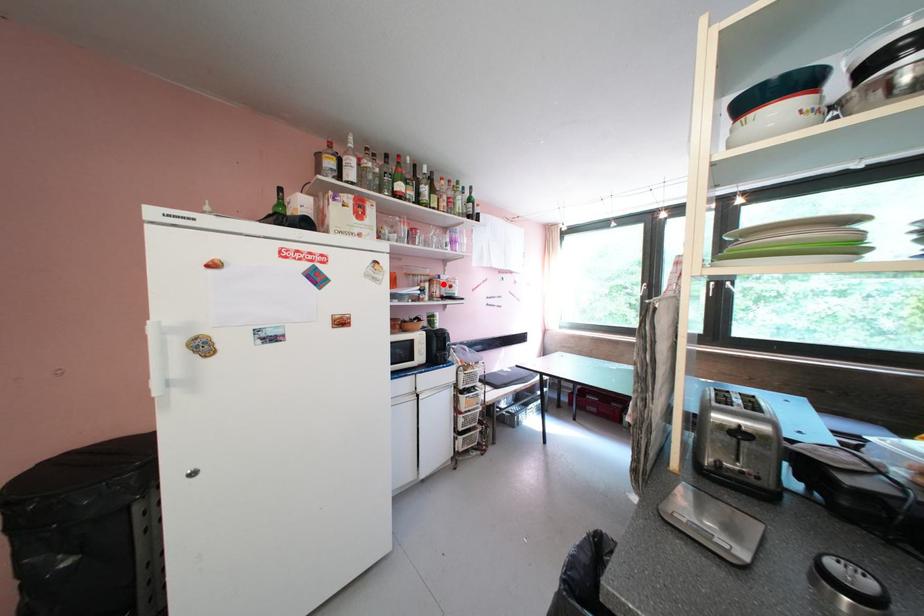
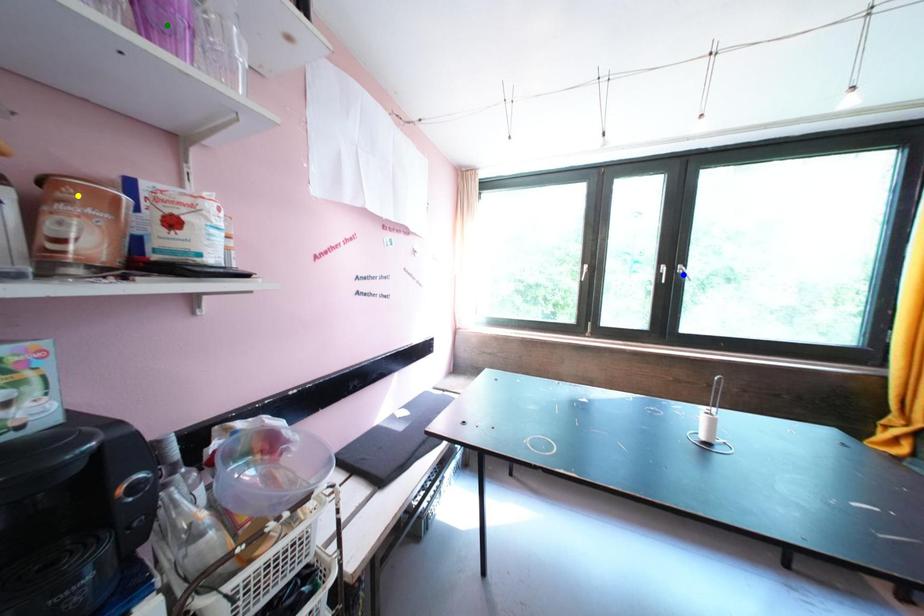
Question: I am providing you with two images of the same scene from different viewpoints. A red point is marked on the first image. You are given multiple points on the second image. Which point in image 2 is actually the same real-world point as the red point in image 1?

Choices:
 (A) green point
 (B) yellow point
 (C) blue point

Answer: (B)